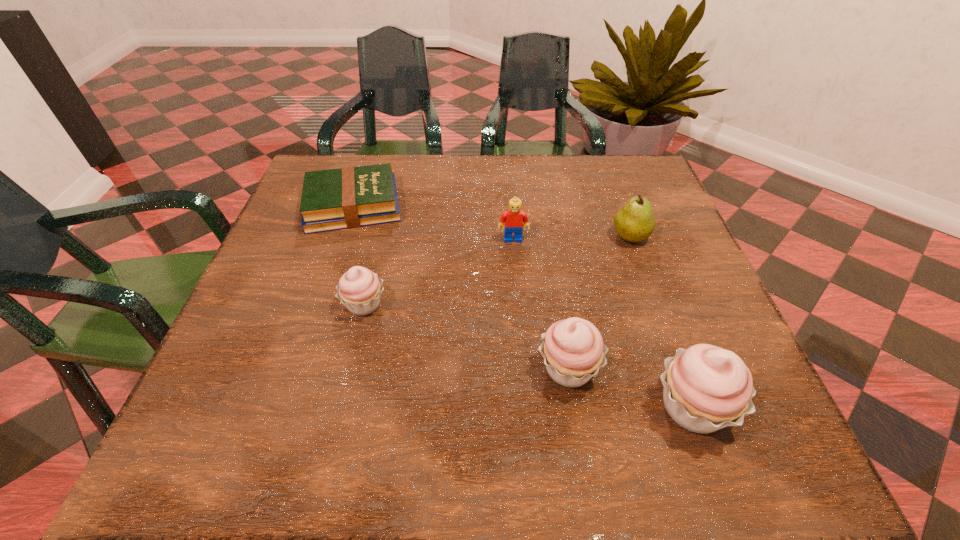
To ensure equal spacing by inserting another cupcake among them, please point out a vacant spot for this new cupcake. Please provide its 2D coordinates. Your answer should be formatted as a tuple, i.e. [(x, y)], where the tuple contains the x and y coordinates of a point satisfying the conditions above.

[(460, 334)]